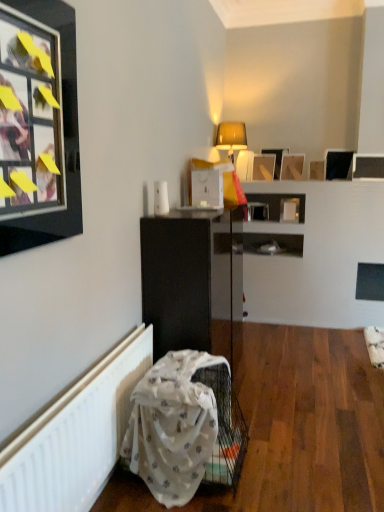
The image size is (384, 512). I want to click on free space above white textured radiator at lower left (from a real-world perspective), so 53,409.